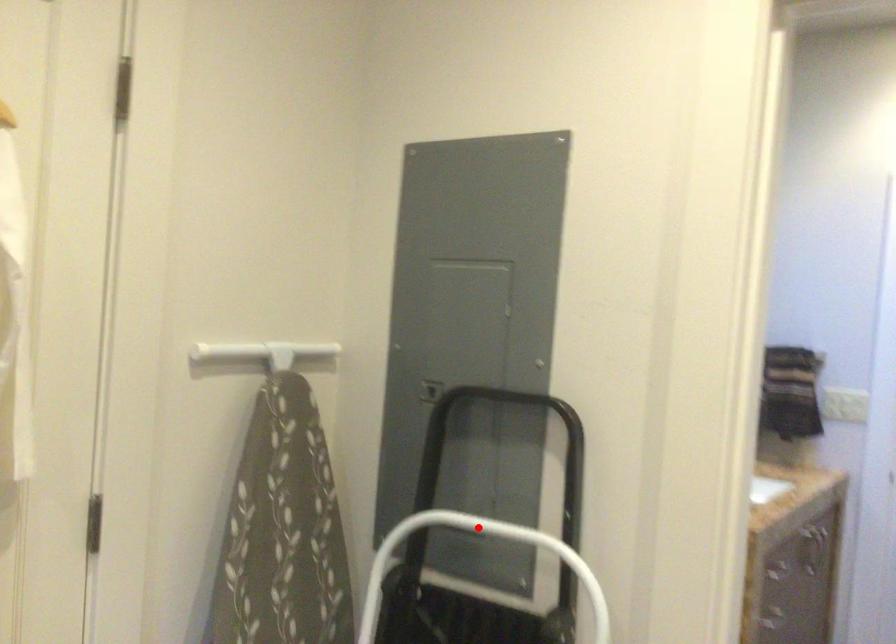
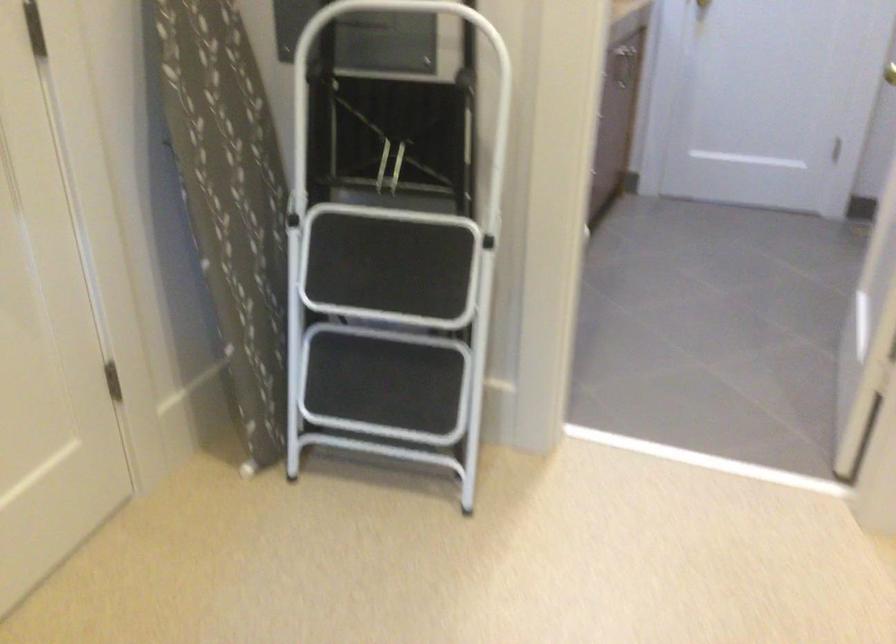
Where in the second image is the point corresponding to the highlighted location from the first image?

(378, 13)